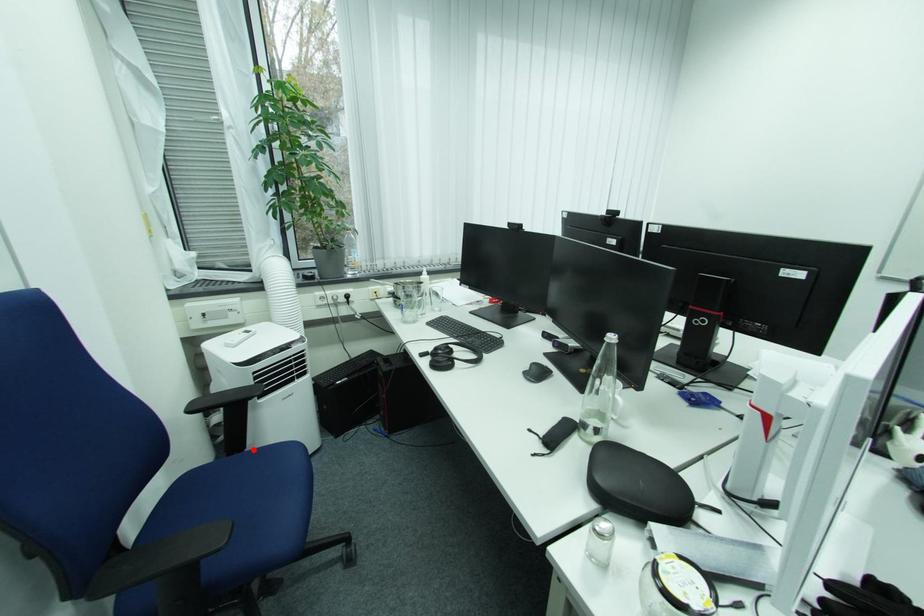
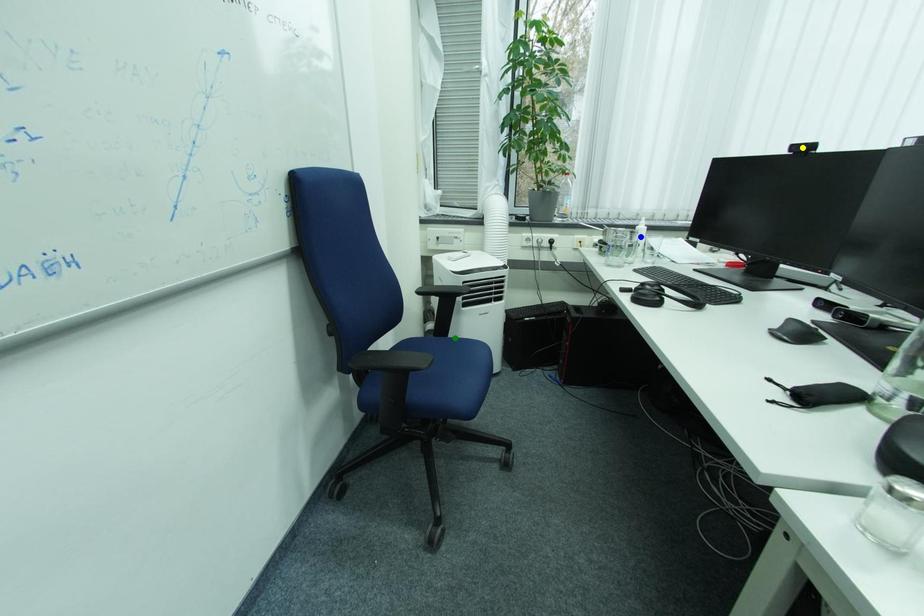
Question: I am providing you with two images of the same scene from different viewpoints. A red point is marked on the first image. You are given multiple points on the second image. In image 2, which mark is for the same physical point as the one in image 1?

Choices:
 (A) green point
 (B) blue point
 (C) yellow point

Answer: (A)